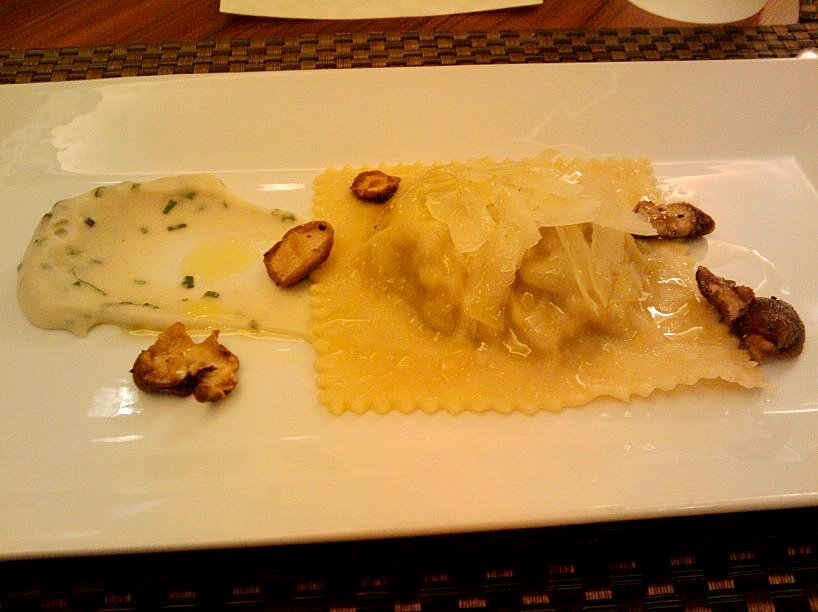
Locate an element on the screen. Image resolution: width=818 pixels, height=612 pixels. white rectangular plate is located at coordinates (353, 499).